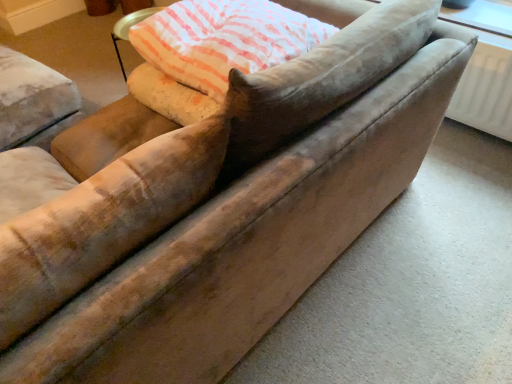
At what (x,y) coordinates should I click in order to perform the action: click on striped cotton throw pillow at center. Please return your answer as a coordinate pair (x, y). Image resolution: width=512 pixels, height=384 pixels. Looking at the image, I should click on (224, 40).

Describe the element at coordinates (224, 40) in the screenshot. I see `striped cotton throw pillow at center` at that location.

Where is `striped cotton throw pillow at center`? striped cotton throw pillow at center is located at coordinates (224, 40).